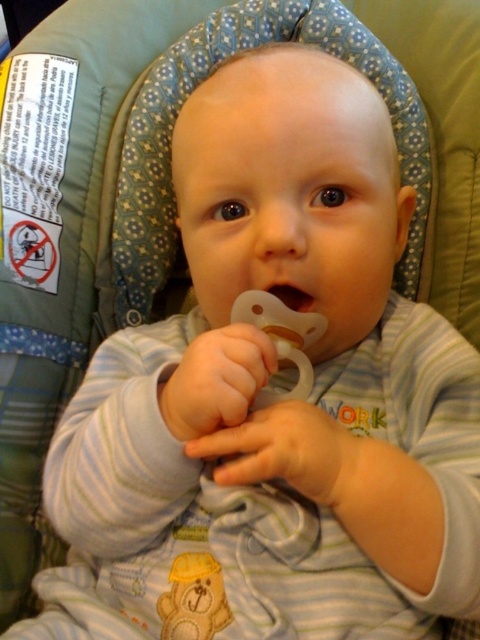
Is yellow fabric teddy bear at center to the right of clear plastic pacifier at center from the viewer's perspective?

Incorrect, yellow fabric teddy bear at center is not on the right side of clear plastic pacifier at center.

Does yellow fabric teddy bear at center have a lesser width compared to clear plastic pacifier at center?

In fact, yellow fabric teddy bear at center might be wider than clear plastic pacifier at center.

Image resolution: width=480 pixels, height=640 pixels. What are the coordinates of `yellow fabric teddy bear at center` in the screenshot? It's located at (193, 598).